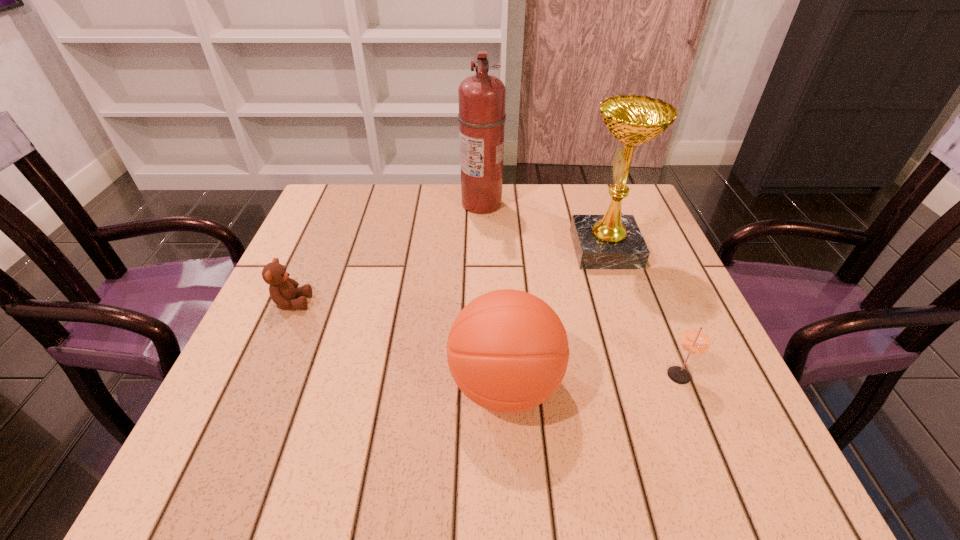
What are the coordinates of `vacant region that satisfies the following two spatial constraints: 1. on the back side of the second shortest object; 2. on the front-facing side of the fourth shortest object` in the screenshot? It's located at (628, 249).

Identify the location of vacant region that satisfies the following two spatial constraints: 1. on the face of the third farthest object; 2. on the back side of the second shortest object. The height and width of the screenshot is (540, 960). tap(259, 375).

This screenshot has width=960, height=540. What are the coordinates of `vacant space that satisfies the following two spatial constraints: 1. on the face of the shortest object; 2. on the right side of the straw` in the screenshot? It's located at (259, 375).

Identify the location of free spot that satisfies the following two spatial constraints: 1. on the front-facing side of the award; 2. on the right side of the straw. The width and height of the screenshot is (960, 540). (648, 375).

Where is `vacant point that satisfies the following two spatial constraints: 1. on the front-facing side of the second tallest object; 2. on the front side of the third tallest object`? vacant point that satisfies the following two spatial constraints: 1. on the front-facing side of the second tallest object; 2. on the front side of the third tallest object is located at coordinates (652, 385).

Where is `free location that satisfies the following two spatial constraints: 1. on the front-facing side of the second farthest object; 2. on the right side of the straw`? free location that satisfies the following two spatial constraints: 1. on the front-facing side of the second farthest object; 2. on the right side of the straw is located at coordinates (648, 375).

This screenshot has height=540, width=960. I want to click on blank area in the image that satisfies the following two spatial constraints: 1. on the front-facing side of the tallest object; 2. on the back side of the third tallest object, so click(x=483, y=385).

Locate an element on the screen. free space that satisfies the following two spatial constraints: 1. on the face of the second shortest object; 2. on the right side of the shortest object is located at coordinates (259, 375).